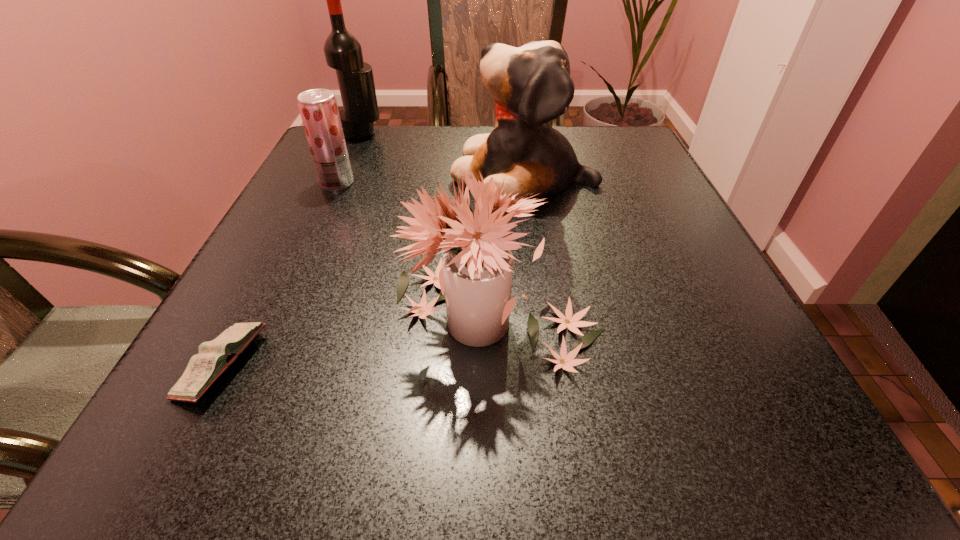
Identify the location of free spot between the tallest object and the diary. (293, 249).

You are a GUI agent. You are given a task and a screenshot of the screen. Output one action in this format:
    pyautogui.click(x=<x>, y=<y>)
    Task: Click on the vacant space that's between the diary and the fruit juice
    The image size is (960, 540).
    Given the screenshot: What is the action you would take?
    pyautogui.click(x=280, y=274)

You are a GUI agent. You are given a task and a screenshot of the screen. Output one action in this format:
    pyautogui.click(x=<x>, y=<y>)
    Task: Click on the free space between the shortest object and the fourth tallest object
    The image size is (960, 540).
    Given the screenshot: What is the action you would take?
    pyautogui.click(x=280, y=274)

Find the location of a particular element. vacant area that lies between the fruit juice and the puppy is located at coordinates click(x=431, y=179).

You are a GUI agent. You are given a task and a screenshot of the screen. Output one action in this format:
    pyautogui.click(x=<x>, y=<y>)
    Task: Click on the vacant space that's between the farthest object and the diary
    The image size is (960, 540).
    Given the screenshot: What is the action you would take?
    (293, 249)

Locate which object is the second closest to the bouquet. Please provide its 2D coordinates. Your answer should be formatted as a tuple, i.e. [(x, y)], where the tuple contains the x and y coordinates of a point satisfying the conditions above.

[(215, 356)]

This screenshot has width=960, height=540. I want to click on object that can be found as the second closest to the bouquet, so click(215, 356).

Where is `vacant space that satisfies the following two spatial constraints: 1. at the face of the puppy; 2. on the front side of the bouquet`? vacant space that satisfies the following two spatial constraints: 1. at the face of the puppy; 2. on the front side of the bouquet is located at coordinates (544, 315).

At what (x,y) coordinates should I click in order to perform the action: click on vacant space that satisfies the following two spatial constraints: 1. on the back side of the diary; 2. on the left side of the tallest object. Please return your answer as a coordinate pair (x, y). Looking at the image, I should click on (342, 133).